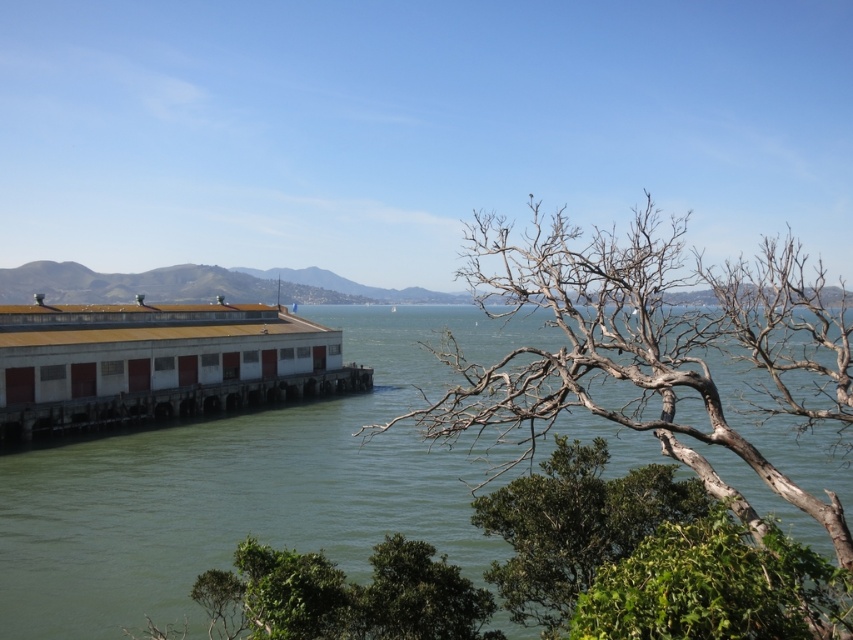
Is green water at lower left positioned in front of bare wood tree at lower right?

No, green water at lower left is behind bare wood tree at lower right.

Is green water at lower left above bare wood tree at lower right?

Incorrect, green water at lower left is not positioned above bare wood tree at lower right.

You are a GUI agent. You are given a task and a screenshot of the screen. Output one action in this format:
    pyautogui.click(x=<x>, y=<y>)
    Task: Click on the green water at lower left
    
    Given the screenshot: What is the action you would take?
    pyautogui.click(x=248, y=484)

How much distance is there between bare wood tree at lower right and white matte dock at lower left?

A distance of 40.28 meters exists between bare wood tree at lower right and white matte dock at lower left.

Does bare wood tree at lower right have a lesser height compared to white matte dock at lower left?

Incorrect, bare wood tree at lower right's height does not fall short of white matte dock at lower left's.

What are the coordinates of `bare wood tree at lower right` in the screenshot? It's located at click(x=651, y=346).

Who is more forward, (x=454, y=387) or (x=512, y=500)?

Point (x=512, y=500)

Is bare wood tree at lower right closer to the viewer compared to green leafy tree at lower right?

Yes.

Does point (523, 458) come closer to viewer compared to point (572, 476)?

Yes.

I want to click on bare wood tree at lower right, so click(651, 346).